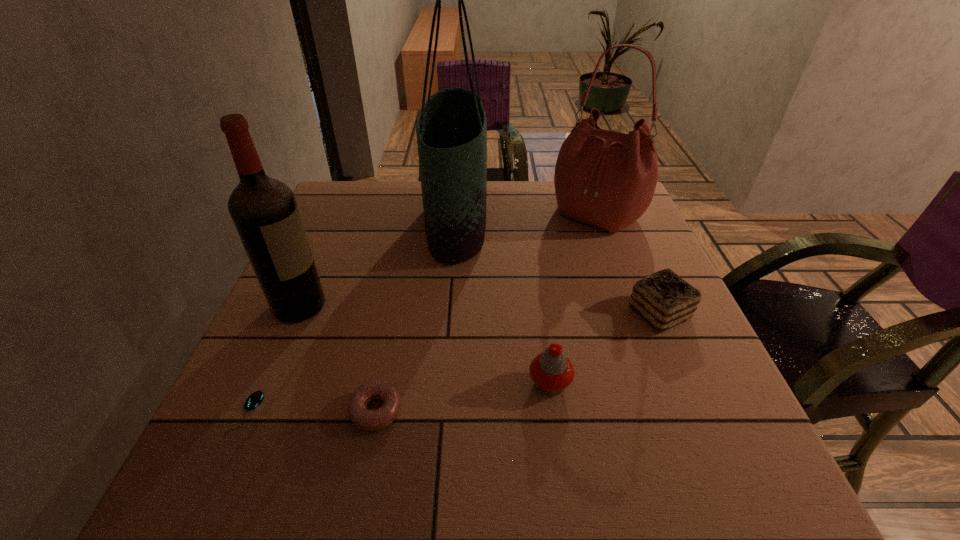
Locate an element on the screen. Image resolution: width=960 pixels, height=540 pixels. free space that satisfies the following two spatial constraints: 1. on the front-facing side of the doughnut; 2. on the right side of the liquor is located at coordinates (253, 410).